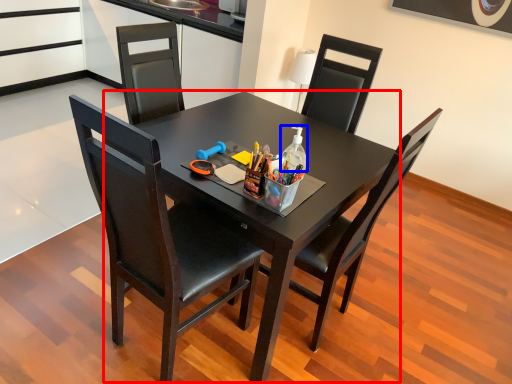
Question: Which point is further to the camera, round table (highlighted by a red box) or bottle (highlighted by a blue box)?

Choices:
 (A) round table
 (B) bottle

Answer: (B)